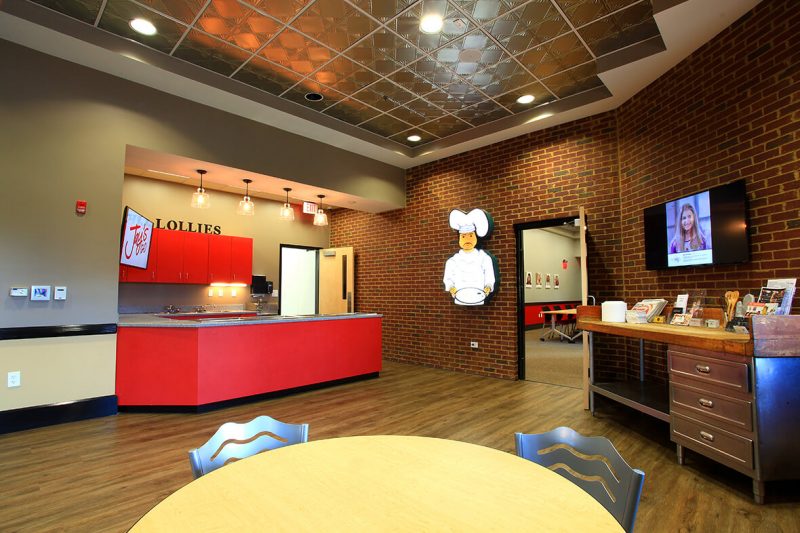
The width and height of the screenshot is (800, 533). Identify the location of drawer. (x=726, y=382), (x=738, y=418), (x=744, y=470).